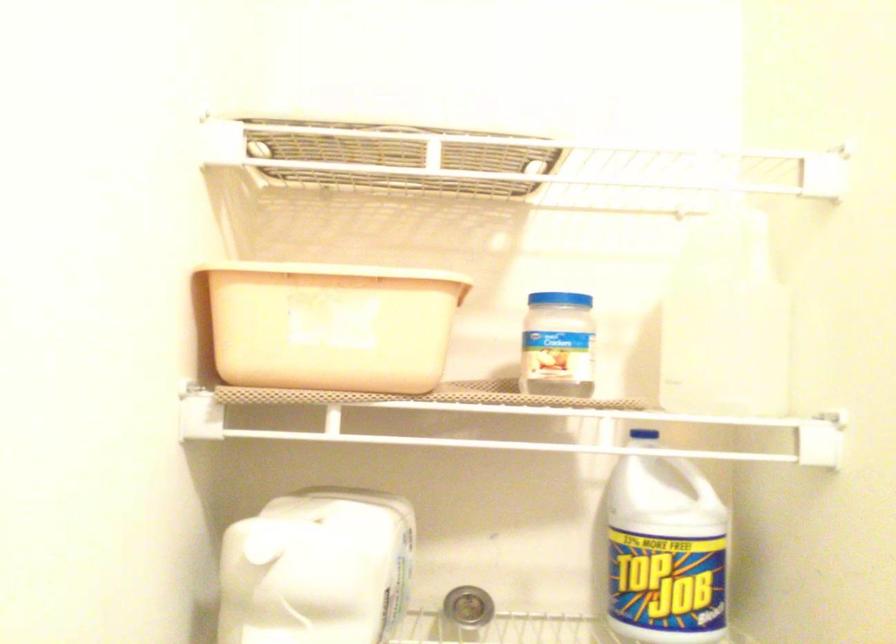
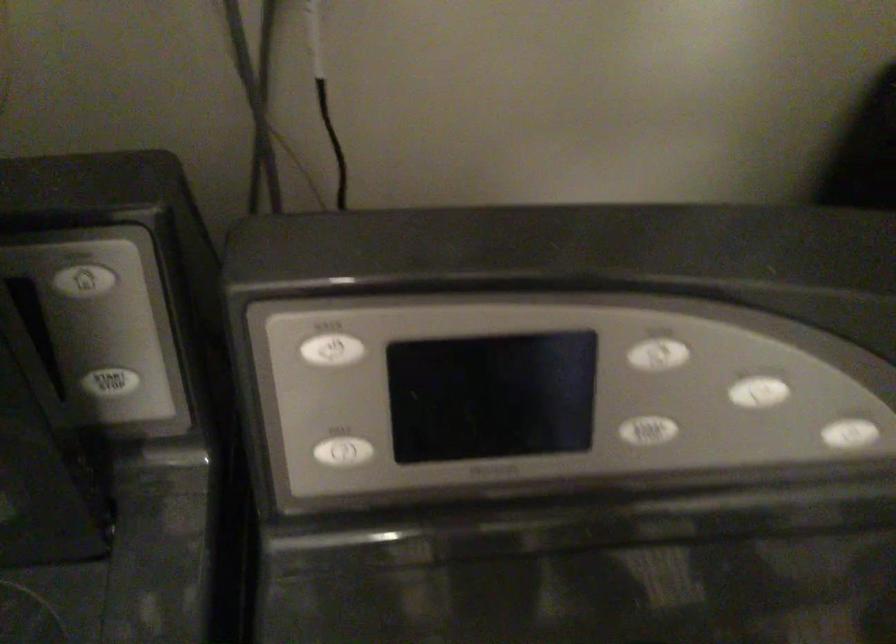
How did the camera likely rotate?

The rotation direction of the camera is right-down.